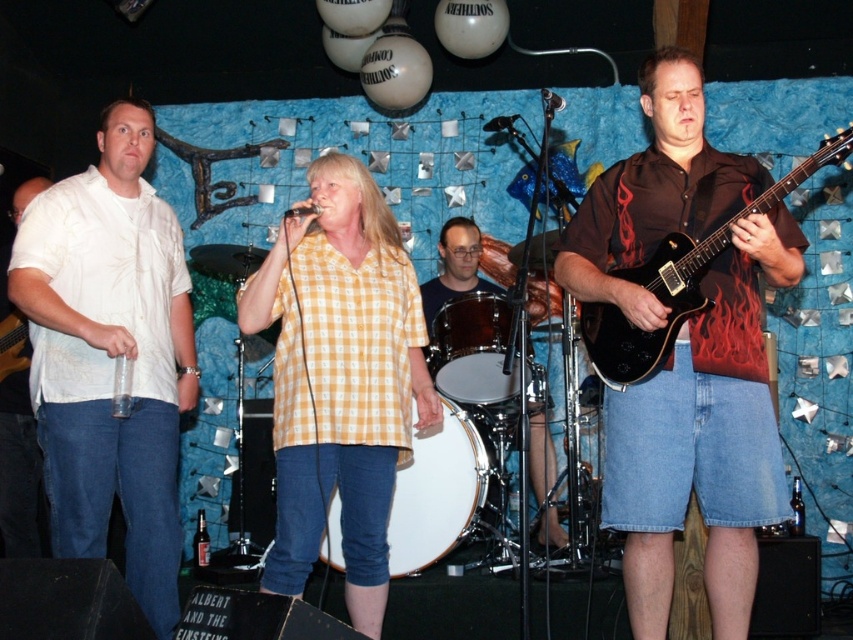
In the scene shown: You are a stagehand who needs to move a 5.5 feet wide equipment cart between the smooth white drum at center and the matte black electric guitar at left. Can the cart fit through the space between them?

The distance between the smooth white drum at center and the matte black electric guitar at left is 6.00 feet. Since the cart is 5.5 feet wide, it can fit through the space as 5.5 is less than 6.00.

You are standing at the center of the stage and want to move towards the direction of point [448,316] and point [468,221]. Which point is closer to your current position?

Point [448,316] is in front of point [468,221], so it is closer to your current position at the center of the stage.

You are a stagehand setting up equipment for the band. You need to place a new microphone stand that requires 1.2 meters of space between it and the nearest drum. Given the sizes of the smooth white drum at center and shiny silver drum at center, which drum should you place the microphone stand closer to to ensure enough space?

The smooth white drum at center has a larger width than the shiny silver drum at center. To ensure the microphone stand has enough space, place it closer to the shiny silver drum at center since it is narrower.